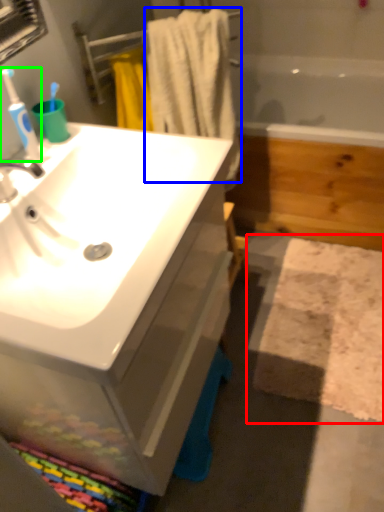
Question: Which object is positioned closest to bath mat (highlighted by a red box)? Select from bath towel (highlighted by a blue box) and toothbrush (highlighted by a green box).

Choices:
 (A) bath towel
 (B) toothbrush

Answer: (A)